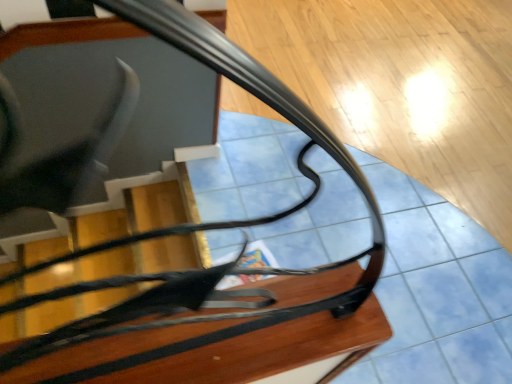
Question: From the image's perspective, is glossy black glass table at center above or below wooden table at center?

Choices:
 (A) above
 (B) below

Answer: (A)

Question: In terms of width, does glossy black glass table at center look wider or thinner when compared to wooden table at center?

Choices:
 (A) wide
 (B) thin

Answer: (A)

Question: Is glossy black glass table at center inside the boundaries of wooden table at center, or outside?

Choices:
 (A) inside
 (B) outside

Answer: (B)

Question: From their relative heights in the image, would you say wooden table at center is taller or shorter than glossy black glass table at center?

Choices:
 (A) short
 (B) tall

Answer: (A)

Question: Is wooden table at center in front of or behind glossy black glass table at center in the image?

Choices:
 (A) front
 (B) behind

Answer: (A)

Question: Based on their positions, is wooden table at center located to the left or right of glossy black glass table at center?

Choices:
 (A) right
 (B) left

Answer: (B)

Question: Is wooden table at center spatially inside glossy black glass table at center, or outside of it?

Choices:
 (A) outside
 (B) inside

Answer: (A)